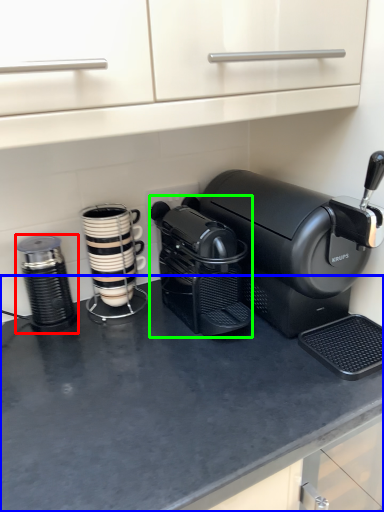
Question: Considering the real-world distances, which object is farthest from kitchen appliance (highlighted by a red box)? counter top (highlighted by a blue box) or coffee maker (highlighted by a green box)?

Choices:
 (A) counter top
 (B) coffee maker

Answer: (A)